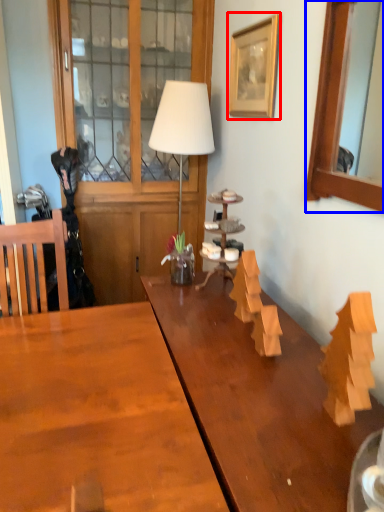
Question: Which object is further to the camera taking this photo, picture frame (highlighted by a red box) or picture frame (highlighted by a blue box)?

Choices:
 (A) picture frame
 (B) picture frame

Answer: (A)